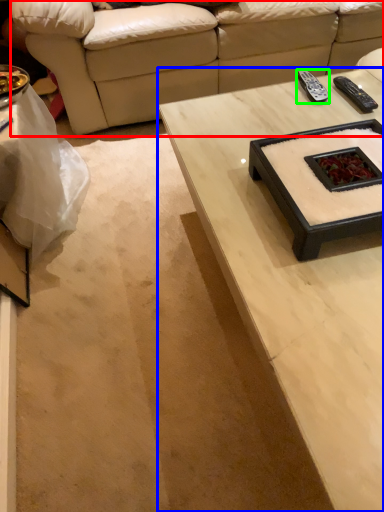
Question: Considering the real-world distances, which object is farthest from studio couch (highlighted by a red box)? coffee table (highlighted by a blue box) or remote (highlighted by a green box)?

Choices:
 (A) coffee table
 (B) remote

Answer: (A)